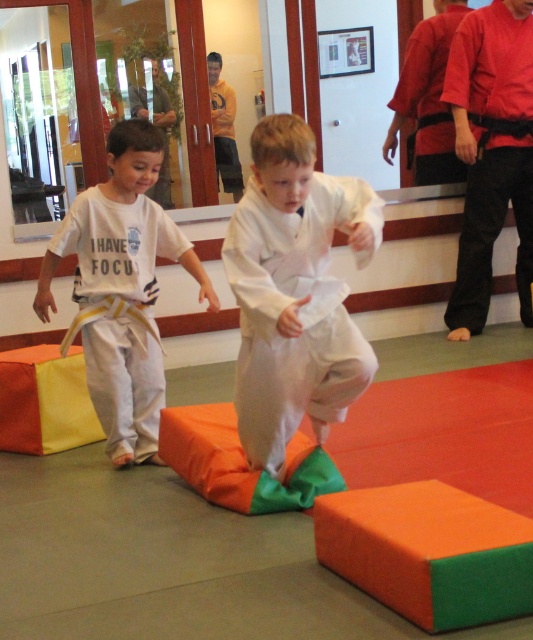
Which is behind, point (328, 193) or point (176, 246)?

Positioned behind is point (176, 246).

Can you confirm if white cotton kimono at center is positioned below yellow belt at left?

Correct, white cotton kimono at center is located below yellow belt at left.

Which is behind, point (272, 420) or point (99, 344)?

The point (99, 344) is more distant.

Identify the location of white cotton kimono at center. Image resolution: width=533 pixels, height=640 pixels. (294, 291).